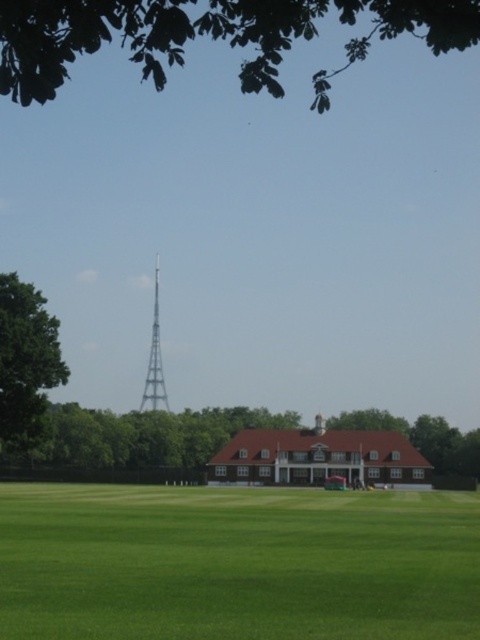
Question: Which object appears farthest from the camera in this image?

Choices:
 (A) green leafy tree at upper center
 (B) silver metallic tower at center
 (C) green grass at lower center

Answer: (B)

Question: Where is green grass at lower center located in relation to green leafy tree at lower center in the image?

Choices:
 (A) left
 (B) right

Answer: (B)

Question: Where is green grass at lower center located in relation to green leafy tree at left in the image?

Choices:
 (A) right
 (B) left

Answer: (A)

Question: Which of the following is the farthest from the observer?

Choices:
 (A) (23, 426)
 (B) (386, 493)
 (C) (145, 376)

Answer: (C)

Question: Which is farther from the green leafy tree at upper center?

Choices:
 (A) silver metallic tower at center
 (B) green leafy tree at lower center
 (C) green grass at lower center
 (D) green leafy tree at left

Answer: (B)

Question: Considering the relative positions of green leafy tree at upper center and green leafy tree at left in the image provided, where is green leafy tree at upper center located with respect to green leafy tree at left?

Choices:
 (A) right
 (B) left

Answer: (A)